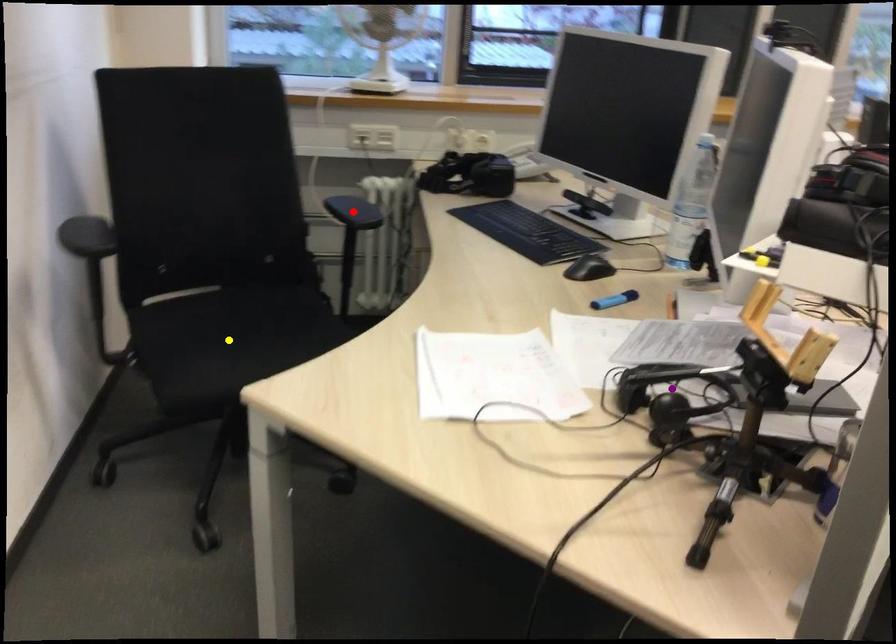
Order these from nearest to farthest:
- red point
- purple point
- yellow point

purple point
yellow point
red point